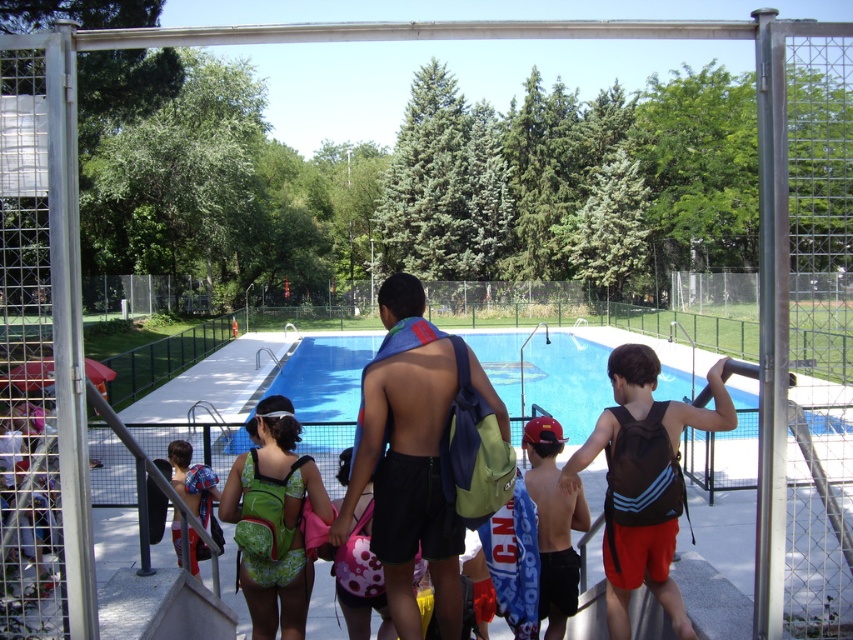
Is red matte cap at center further to the viewer compared to green fabric backpack at lower left?

No, it is not.

Which is above, red matte cap at center or green fabric backpack at lower left?

red matte cap at center is above.

Who is more forward, (544, 488) or (190, 531)?

Positioned in front is point (544, 488).

Where is `red matte cap at center`? This screenshot has width=853, height=640. red matte cap at center is located at coordinates (553, 524).

Does green fabric backpack at center have a greater width compared to blue smooth water at center?

No, green fabric backpack at center is not wider than blue smooth water at center.

Which of these two, green fabric backpack at center or blue smooth water at center, stands taller?

With more height is blue smooth water at center.

What do you see at coordinates (407, 458) in the screenshot? I see `green fabric backpack at center` at bounding box center [407, 458].

At what (x,y) coordinates should I click in order to perform the action: click on green fabric backpack at center. Please return your answer as a coordinate pair (x, y). The image size is (853, 640). Looking at the image, I should click on (407, 458).

Does blue smooth water at center have a larger size compared to red matte cap at center?

Correct, blue smooth water at center is larger in size than red matte cap at center.

Can you confirm if blue smooth water at center is wider than red matte cap at center?

Yes.

You are a GUI agent. You are given a task and a screenshot of the screen. Output one action in this format:
    pyautogui.click(x=<x>, y=<y>)
    Task: Click on the blue smooth water at center
    This screenshot has height=640, width=853.
    Given the screenshot: What is the action you would take?
    pyautogui.click(x=567, y=381)